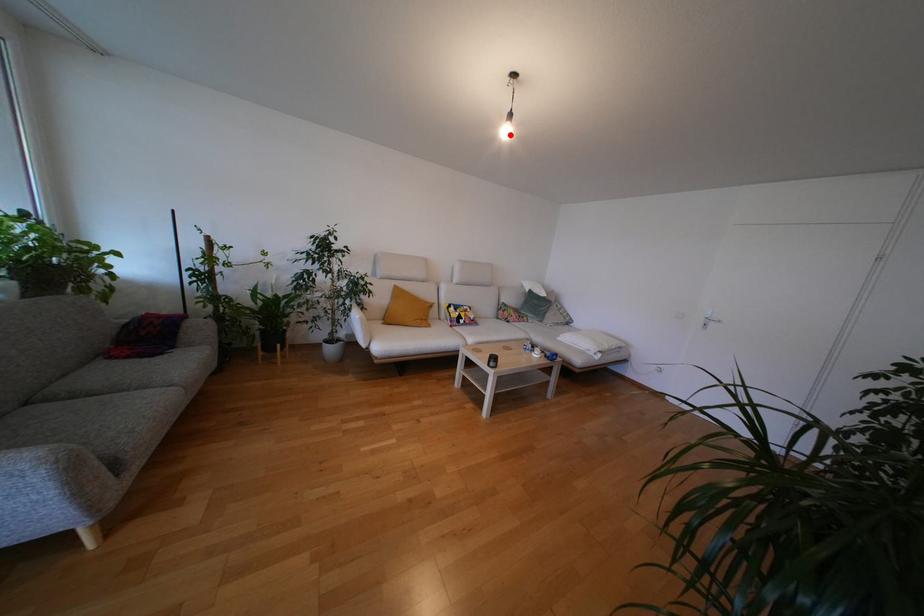
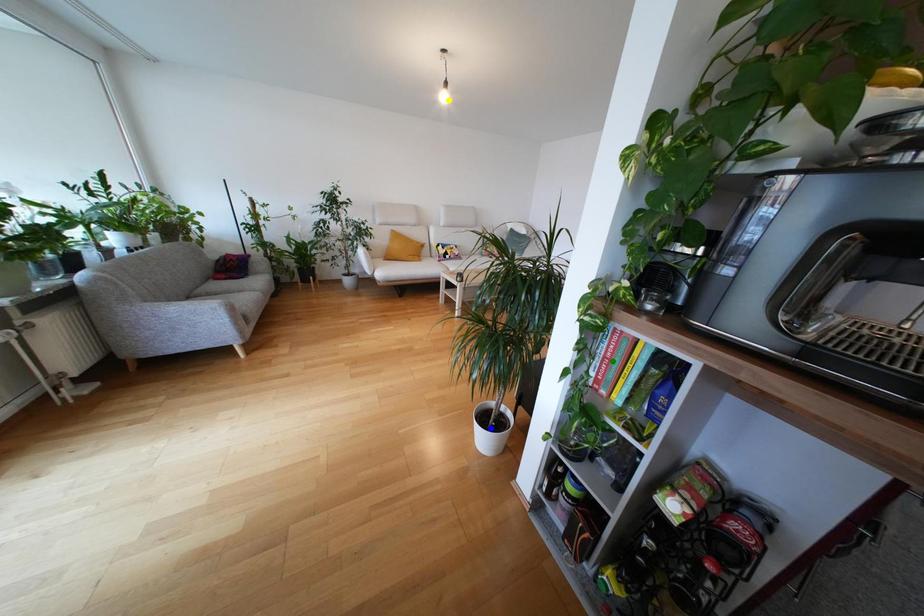
Question: I am providing you with two images of the same scene from different viewpoints. A red point is marked on the first image. You are given multiple points on the second image. Which point in image 2 represents the same 3d spot as the red point in image 1?

Choices:
 (A) blue point
 (B) yellow point
 (C) green point

Answer: (B)